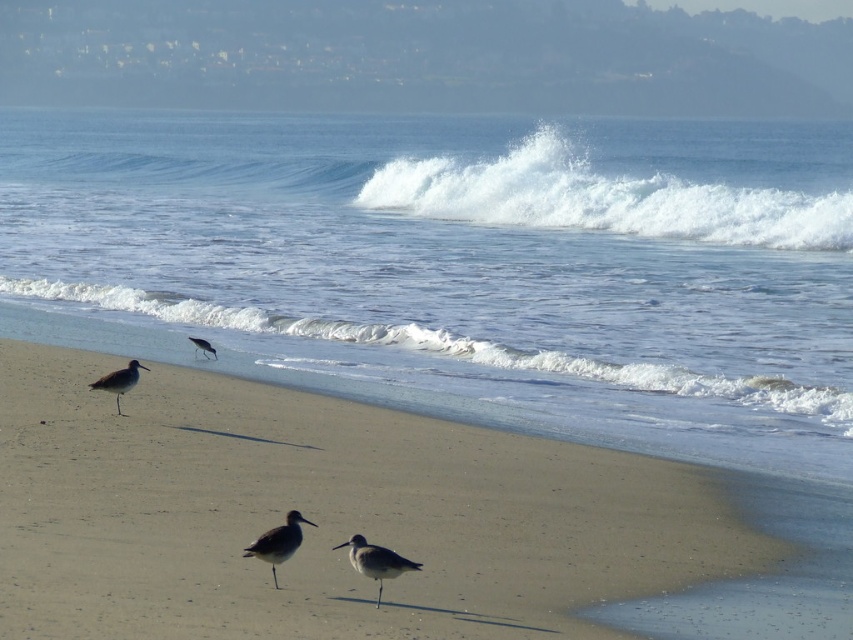
Question: Which point is closer to the camera?

Choices:
 (A) (135, 371)
 (B) (259, 557)

Answer: (B)

Question: Which of the following is the closest to the observer?

Choices:
 (A) brown feathered bird at center
 (B) sandy beach at lower center
 (C) gray matte bird at left

Answer: (B)

Question: Is clear blue water at center smaller than gray matte bird at left?

Choices:
 (A) no
 (B) yes

Answer: (A)

Question: Can you confirm if gray matte bird at center is positioned to the right of gray matte bird at left?

Choices:
 (A) no
 (B) yes

Answer: (B)

Question: Can you confirm if sandy beach at lower center is positioned below brown feathered bird at center?

Choices:
 (A) no
 (B) yes

Answer: (A)

Question: Which object appears farthest from the camera in this image?

Choices:
 (A) white frothy wave at upper center
 (B) white foamy wave at lower center
 (C) brown feathered bird at center

Answer: (A)